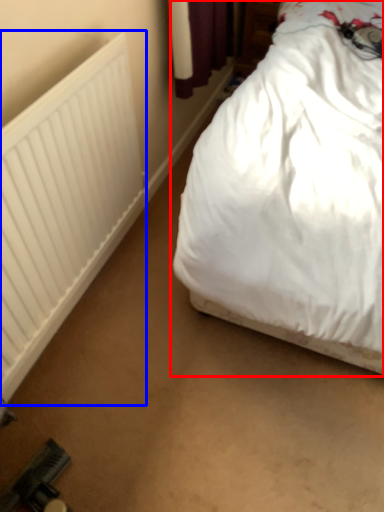
Question: Among these objects, which one is farthest to the camera, bed (highlighted by a red box) or radiator (highlighted by a blue box)?

Choices:
 (A) bed
 (B) radiator

Answer: (B)